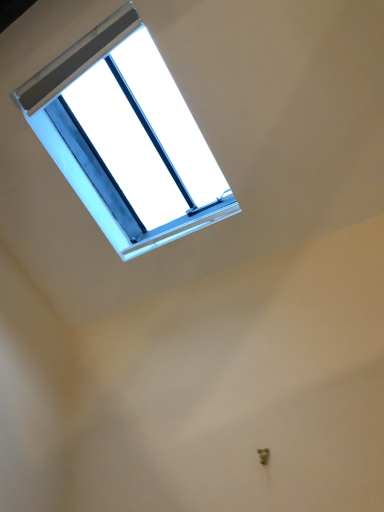
Where is `transparent plastic window at upper center`? transparent plastic window at upper center is located at coordinates (144, 123).

What is the approximate height of transparent plastic window at upper center?

The height of transparent plastic window at upper center is 21.41 inches.

What do you see at coordinates (144, 123) in the screenshot? I see `transparent plastic window at upper center` at bounding box center [144, 123].

Find the location of a particular element. This screenshot has height=512, width=384. transparent plastic window at upper center is located at coordinates (144, 123).